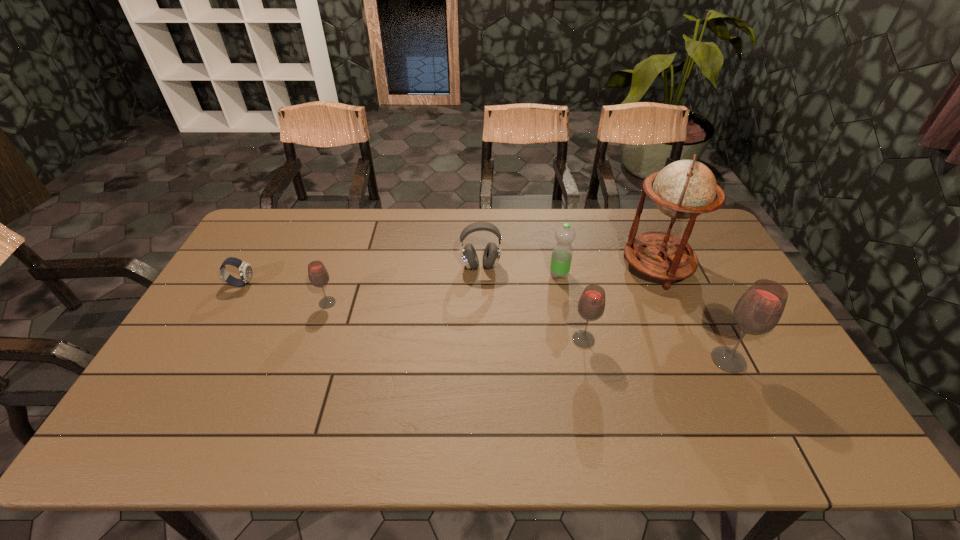
Identify the location of the third nearest object. Image resolution: width=960 pixels, height=540 pixels. (318, 275).

Find the location of a particular element. This screenshot has height=540, width=960. the shortest glass drink container is located at coordinates pos(318,275).

The height and width of the screenshot is (540, 960). In order to click on the second tallest glass drink container in this screenshot , I will do `click(591, 305)`.

Where is `the rightmost glass drink container`? Image resolution: width=960 pixels, height=540 pixels. the rightmost glass drink container is located at coordinates (758, 311).

What are the coordinates of `the tallest glass drink container` in the screenshot? It's located at (758, 311).

In order to click on the third object from left to right in this screenshot , I will do pyautogui.click(x=492, y=252).

You are a GUI agent. You are given a task and a screenshot of the screen. Output one action in this format:
    pyautogui.click(x=<x>, y=<y>)
    Task: Click on the globe
    The image size is (960, 540).
    Given the screenshot: What is the action you would take?
    pyautogui.click(x=684, y=189)

I want to click on water bottle, so click(562, 252).

Where is `the leftmost object`? the leftmost object is located at coordinates (245, 270).

Image resolution: width=960 pixels, height=540 pixels. Identify the location of watch. (245, 270).